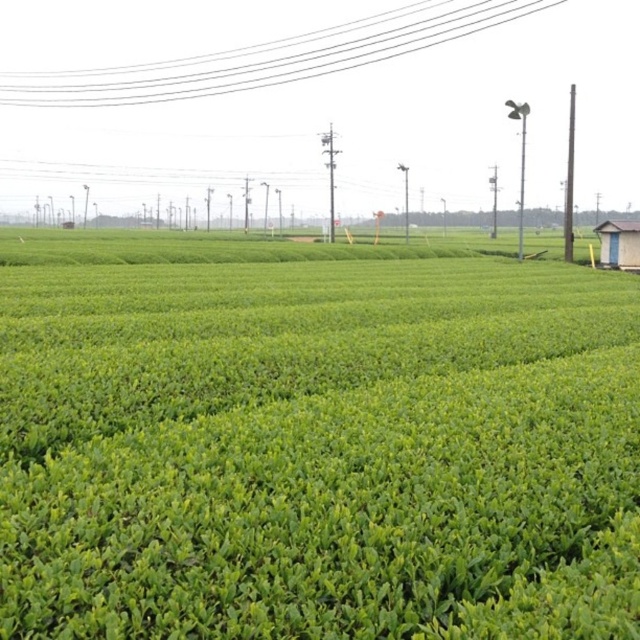
Based on the photo, is green leafy field at center positioned behind white plastic hut at right?

No, green leafy field at center is in front of white plastic hut at right.

In the scene shown: Can you confirm if green leafy field at center is bigger than white plastic hut at right?

Yes.

Is point (97, 602) farther from camera compared to point (625, 252)?

No.

Identify the location of green leafy field at center. The image size is (640, 640). (314, 440).

Does white wire at upper center appear on the left side of white plastic hut at right?

Indeed, white wire at upper center is positioned on the left side of white plastic hut at right.

Does white wire at upper center have a greater width compared to white plastic hut at right?

Correct, the width of white wire at upper center exceeds that of white plastic hut at right.

Who is more forward, (60, 84) or (621, 253)?

Point (621, 253) is more forward.

This screenshot has height=640, width=640. Identify the location of white wire at upper center. (268, 58).

Is green leafy field at center in front of white wire at upper center?

Yes, green leafy field at center is in front of white wire at upper center.

Is point (332, 563) closer to camera compared to point (52, 104)?

Yes.

Find the location of a particular element. Image resolution: width=640 pixels, height=640 pixels. green leafy field at center is located at coordinates (314, 440).